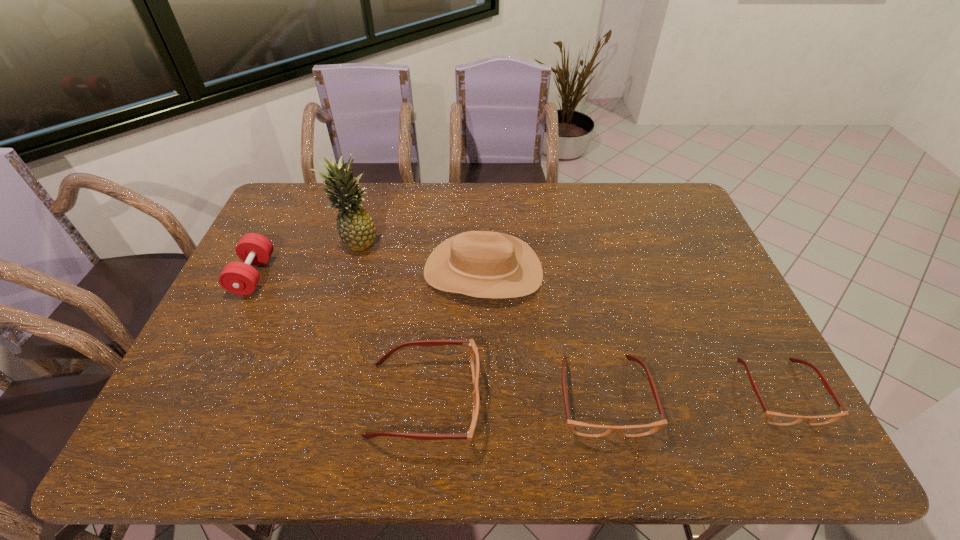
The height and width of the screenshot is (540, 960). Identify the location of vacant space positioned on the front-facing side of the leftmost spectacles. (551, 400).

This screenshot has height=540, width=960. In order to click on vacant space located 0.300m on the right of the tallest object in this screenshot , I will do `click(471, 241)`.

Identify the location of free space located 0.390m on the right of the fourth shortest object. (397, 275).

This screenshot has width=960, height=540. Find the location of `free space located on the right of the cowboy hat`. free space located on the right of the cowboy hat is located at coordinates (654, 271).

Identify the location of object situated at the left edge. (239, 278).

Find the location of a particular element. The image size is (960, 540). object at the right edge is located at coordinates (774, 418).

Locate an element on the screen. object that is at the near right corner is located at coordinates (774, 418).

In the image, there is a desktop. Where is `vacant space at the far edge`? The image size is (960, 540). vacant space at the far edge is located at coordinates (616, 187).

In the image, there is a desktop. Identify the location of vacant space at the near edge. coord(589,398).

Locate an element on the screen. The height and width of the screenshot is (540, 960). vacant space at the left edge of the desktop is located at coordinates (285, 234).